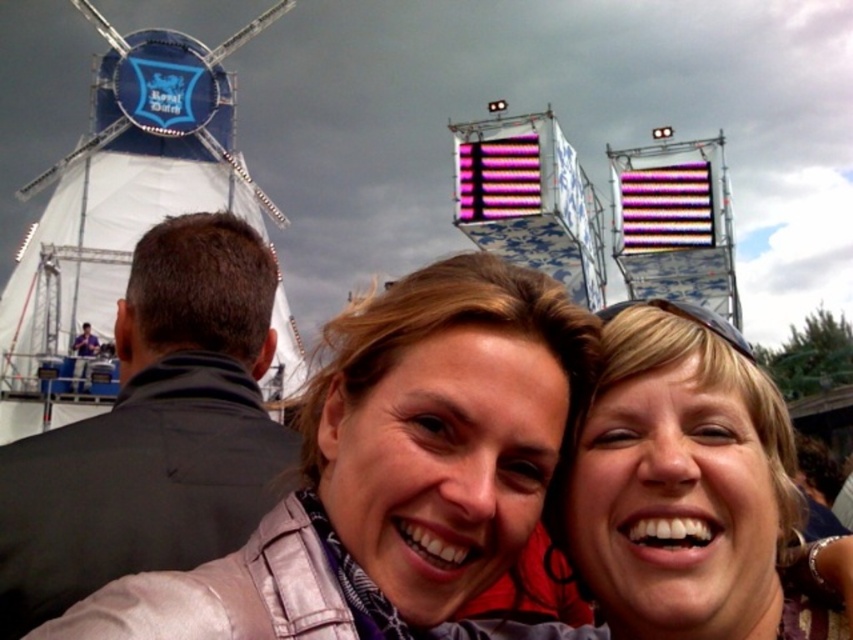
Question: In this image, where is matte gray jacket at center located relative to black leather jacket at upper left?

Choices:
 (A) left
 (B) right

Answer: (B)

Question: Is matte gray jacket at center below black leather jacket at upper left?

Choices:
 (A) no
 (B) yes

Answer: (B)

Question: Which point is farther from the camera taking this photo?

Choices:
 (A) (119, 545)
 (B) (387, 620)

Answer: (A)

Question: Does matte gray jacket at center appear on the right side of black leather jacket at upper left?

Choices:
 (A) yes
 (B) no

Answer: (A)

Question: Which object is farther from the camera taking this photo?

Choices:
 (A) black leather jacket at upper left
 (B) matte gray jacket at center

Answer: (A)